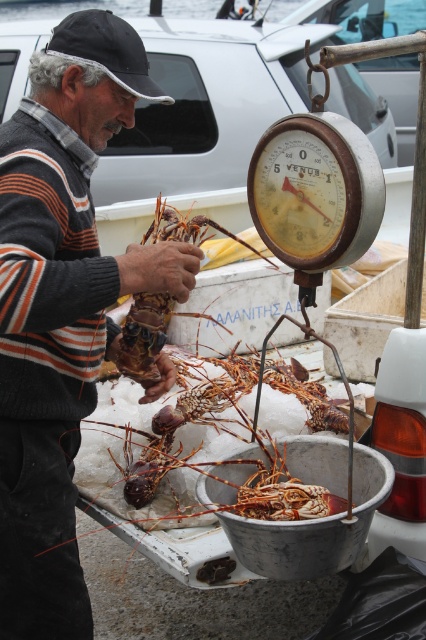
Where is the striped sweater at center located in the image?

The striped sweater at center is located at point (62, 307) in the image.

You are a customer at the seafood market and want to know if the striped sweater at center worn by the man is larger than the orange rough lobster at center he is holding. Can you confirm this?

The striped sweater at center is bigger than orange rough lobster at center, so yes, the striped sweater at center is larger than the orange rough lobster at center.